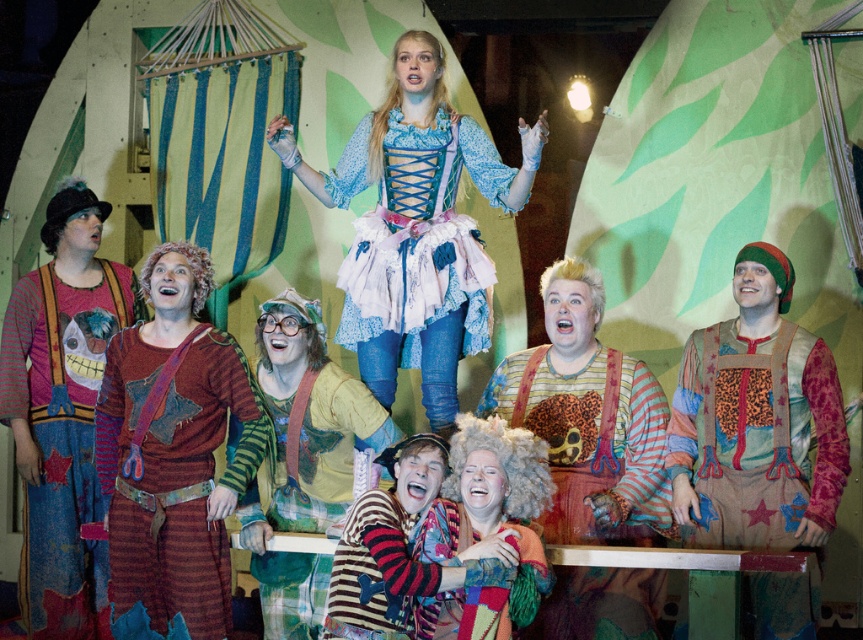
The width and height of the screenshot is (863, 640). Find the location of `striped woolen tunic at left`. striped woolen tunic at left is located at coordinates (172, 481).

Between point (222, 339) and point (451, 380), which one is positioned behind?

Positioned behind is point (451, 380).

Where is `striped woolen tunic at left`? striped woolen tunic at left is located at coordinates (172, 481).

Can you confirm if distressed denim outfit at left is smaller than matte blue dress at center?

Yes.

Image resolution: width=863 pixels, height=640 pixels. Find the location of `distressed denim outfit at left`. distressed denim outfit at left is located at coordinates (61, 436).

You are a GUI agent. You are given a task and a screenshot of the screen. Output one action in this format:
    pyautogui.click(x=<x>, y=<y>)
    Task: Click on the distressed denim outfit at left
    This screenshot has width=863, height=640.
    Given the screenshot: What is the action you would take?
    pyautogui.click(x=61, y=436)

Is striped woolen tunic at left shorter than striped knit sweater at lower center?

In fact, striped woolen tunic at left may be taller than striped knit sweater at lower center.

Identify the location of striped woolen tunic at left. This screenshot has height=640, width=863. (172, 481).

Image resolution: width=863 pixels, height=640 pixels. Find the location of `striped woolen tunic at left`. striped woolen tunic at left is located at coordinates (172, 481).